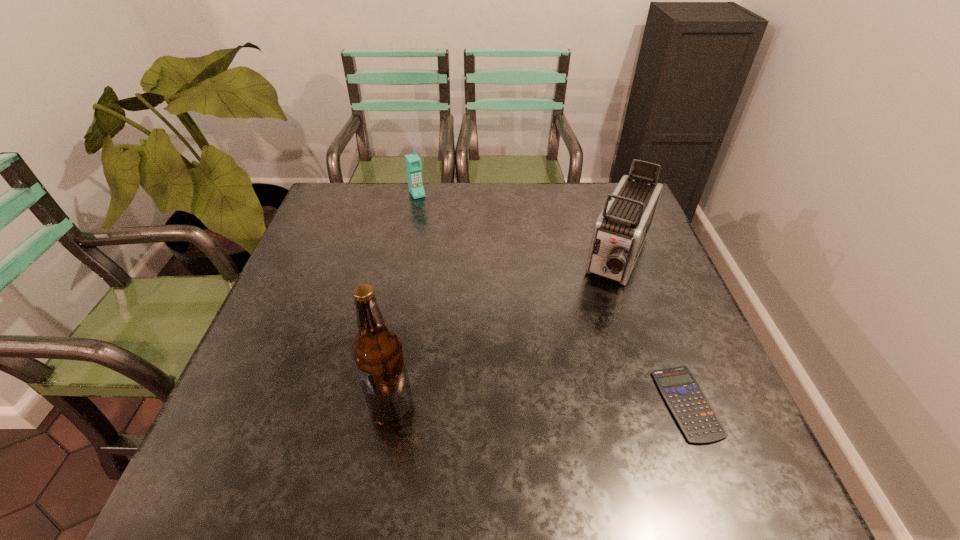
You are a GUI agent. You are given a task and a screenshot of the screen. Output one action in this format:
    pyautogui.click(x=<x>, y=<y>)
    Task: Click on the vacant area between the beer bottle and the shortest object
    The width and height of the screenshot is (960, 540).
    Given the screenshot: What is the action you would take?
    pyautogui.click(x=539, y=404)

The width and height of the screenshot is (960, 540). In order to click on vacant space that's between the camcorder and the shortest object in this screenshot , I will do `click(654, 330)`.

Where is `free space between the third tallest object and the beer bottle`? The width and height of the screenshot is (960, 540). free space between the third tallest object and the beer bottle is located at coordinates (404, 300).

Locate an element on the screen. The width and height of the screenshot is (960, 540). vacant space that is in between the calculator and the camcorder is located at coordinates (654, 330).

Identify the location of empty space that is in between the beer bottle and the second tallest object. The height and width of the screenshot is (540, 960). (505, 332).

This screenshot has width=960, height=540. In order to click on empty space between the calculator and the camcorder in this screenshot , I will do `click(654, 330)`.

At what (x,y) coordinates should I click in order to perform the action: click on vacant region between the shortest object and the second shortest object. Please return your answer as a coordinate pair (x, y). Image resolution: width=960 pixels, height=540 pixels. Looking at the image, I should click on (552, 299).

This screenshot has height=540, width=960. Identify the location of free point between the second tallest object and the calculator. (654, 330).

Find the location of a particular element. empty location between the calculator and the third tallest object is located at coordinates (552, 299).

Point out which object is positioned as the third nearest to the second farthest object. Please provide its 2D coordinates. Your answer should be formatted as a tuple, i.e. [(x, y)], where the tuple contains the x and y coordinates of a point satisfying the conditions above.

[(377, 350)]